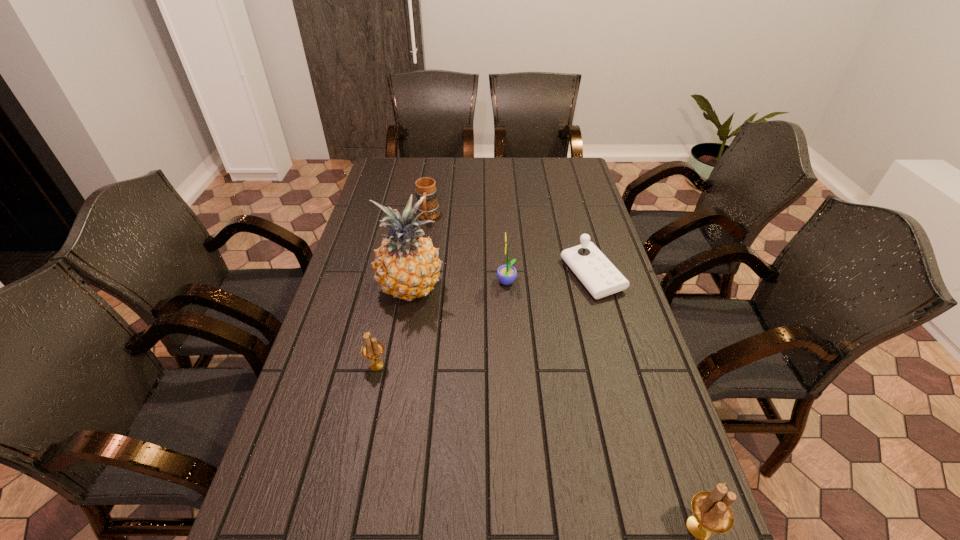
The height and width of the screenshot is (540, 960). What are the coordinates of `free space located 0.080m on the side of the mug with the handle` in the screenshot? It's located at (424, 240).

The height and width of the screenshot is (540, 960). What are the coordinates of `vacant point located on the right of the tallest object` in the screenshot? It's located at (469, 289).

I want to click on vacant space located 0.310m on the back of the shortest object, so click(x=571, y=202).

This screenshot has width=960, height=540. What are the coordinates of `candle holder situated at the left edge` in the screenshot? It's located at (373, 349).

Where is `pineapple that is at the left edge`? pineapple that is at the left edge is located at coordinates (407, 266).

I want to click on object at the right edge, so click(601, 278).

Where is `free location at the far edge of the desktop`? free location at the far edge of the desktop is located at coordinates (499, 157).

Where is `vacant space at the near edge`? The width and height of the screenshot is (960, 540). vacant space at the near edge is located at coordinates (545, 514).

This screenshot has width=960, height=540. What are the coordinates of `free spot at the left edge of the desktop` in the screenshot? It's located at (339, 462).

The image size is (960, 540). I want to click on blank area at the right edge, so click(662, 417).